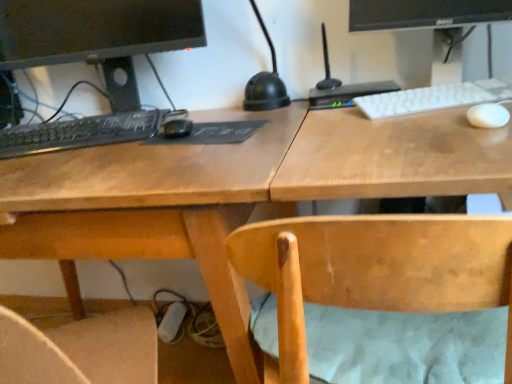
Locate an element on the screen. free area in between white matte keyboard at upper right, the 1th computer keyboard in the right-to-left sequence, and white matte mouse at upper right is located at coordinates (452, 112).